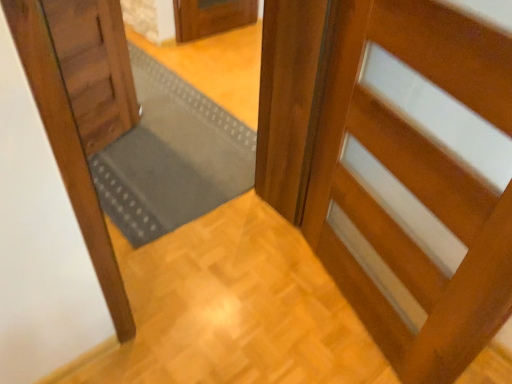
Describe the element at coordinates (233, 309) in the screenshot. This screenshot has height=384, width=512. I see `wooden staircase at lower right` at that location.

This screenshot has height=384, width=512. What do you see at coordinates (170, 157) in the screenshot? I see `gray rubber doormat at center` at bounding box center [170, 157].

The height and width of the screenshot is (384, 512). In order to click on wooden door at left, placed as the 1th door when sorted from left to right in this screenshot , I will do `click(94, 68)`.

Image resolution: width=512 pixels, height=384 pixels. I want to click on glossy wood door at right, the first door positioned from the right, so pos(417,183).

In the image, is wooden door at left, placed as the 1th door when sorted from left to right, on the left side or the right side of gray rubber doormat at center?

Based on their positions, wooden door at left, placed as the 1th door when sorted from left to right, is located to the left of gray rubber doormat at center.

Is wooden door at left, placed as the 1th door when sorted from left to right, inside the boundaries of gray rubber doormat at center, or outside?

wooden door at left, placed as the 1th door when sorted from left to right, lies outside gray rubber doormat at center.

From the image's perspective, relative to wooden staircase at lower right, is gray rubber doormat at center above or below?

Clearly, from the image's perspective, gray rubber doormat at center is above wooden staircase at lower right.

Is gray rubber doormat at center aimed at wooden staircase at lower right?

Yes, gray rubber doormat at center is turned towards wooden staircase at lower right.

At what (x,y) coordinates should I click in order to perform the action: click on path lying below the gray rubber doormat at center (from the image's perspective). Please return your answer as a coordinate pair (x, y). This screenshot has height=384, width=512. Looking at the image, I should click on (233, 309).

Is gray rubber doormat at center inside the boundaries of wooden staircase at lower right, or outside?

gray rubber doormat at center lies outside wooden staircase at lower right.

From a real-world perspective, is glossy wood door at right, positioned as the 2th door in left-to-right order, over gray rubber doormat at center?

Yes, from a real-world perspective, glossy wood door at right, positioned as the 2th door in left-to-right order, is over gray rubber doormat at center

Can gray rubber doormat at center be found inside glossy wood door at right, the first door positioned from the right?

No, gray rubber doormat at center is not inside glossy wood door at right, the first door positioned from the right.

Does glossy wood door at right, the first door positioned from the right, appear on the right side of gray rubber doormat at center?

Correct, you'll find glossy wood door at right, the first door positioned from the right, to the right of gray rubber doormat at center.

What's the angular difference between glossy wood door at right, the first door positioned from the right, and gray rubber doormat at center's facing directions?

118 degrees.

Based on the photo, from the image's perspective, is wooden staircase at lower right above gray rubber doormat at center?

Actually, wooden staircase at lower right appears below gray rubber doormat at center in the image.

Considering the relative sizes of wooden staircase at lower right and gray rubber doormat at center in the image provided, is wooden staircase at lower right smaller than gray rubber doormat at center?

Yes, wooden staircase at lower right is smaller than gray rubber doormat at center.

Which is correct: wooden staircase at lower right is inside gray rubber doormat at center, or outside of it?

wooden staircase at lower right is not inside gray rubber doormat at center, it's outside.

Can you confirm if wooden staircase at lower right is smaller than wooden door at left, positioned as the second door in right-to-left order?

Yes.

Does wooden staircase at lower right have a lesser width compared to wooden door at left, placed as the 1th door when sorted from left to right?

Incorrect, the width of wooden staircase at lower right is not less than that of wooden door at left, placed as the 1th door when sorted from left to right.

Is wooden staircase at lower right closer to the viewer compared to wooden door at left, placed as the 1th door when sorted from left to right?

Yes, the depth of wooden staircase at lower right is less than that of wooden door at left, placed as the 1th door when sorted from left to right.

From a real-world perspective, which is physically below, wooden staircase at lower right or wooden door at left, placed as the 1th door when sorted from left to right?

wooden staircase at lower right.

Is point (167, 269) closer or farther from the camera than point (403, 67)?

Clearly, point (167, 269) is more distant from the camera than point (403, 67).

Are wooden staircase at lower right and glossy wood door at right, positioned as the 2th door in left-to-right order, far apart?

No, wooden staircase at lower right is not far from glossy wood door at right, positioned as the 2th door in left-to-right order.

Can glossy wood door at right, the first door positioned from the right, be found inside wooden staircase at lower right?

No, glossy wood door at right, the first door positioned from the right, is not inside wooden staircase at lower right.

Is wooden staircase at lower right at the right side of glossy wood door at right, positioned as the 2th door in left-to-right order?

No.

Considering the sizes of objects gray rubber doormat at center and glossy wood door at right, positioned as the 2th door in left-to-right order, in the image provided, who is bigger, gray rubber doormat at center or glossy wood door at right, positioned as the 2th door in left-to-right order,?

Bigger between the two is glossy wood door at right, positioned as the 2th door in left-to-right order.

From the image's perspective, which object appears higher, gray rubber doormat at center or glossy wood door at right, the first door positioned from the right?

gray rubber doormat at center.

Identify the location of the 1st door in front of the gray rubber doormat at center, counting from the anchor's position. (94, 68).

Where is `doormat to the left of wooden staircase at lower right`? This screenshot has width=512, height=384. doormat to the left of wooden staircase at lower right is located at coordinates (170, 157).

Considering their positions, is gray rubber doormat at center positioned closer to wooden door at left, placed as the 1th door when sorted from left to right, than wooden staircase at lower right?

gray rubber doormat at center is closer to wooden door at left, placed as the 1th door when sorted from left to right.

Based on their spatial positions, is wooden door at left, positioned as the second door in right-to-left order, or glossy wood door at right, positioned as the 2th door in left-to-right order, further from gray rubber doormat at center?

glossy wood door at right, positioned as the 2th door in left-to-right order.

Consider the image. Based on their spatial positions, is wooden staircase at lower right or wooden door at left, positioned as the second door in right-to-left order, closer to gray rubber doormat at center?

Among the two, wooden door at left, positioned as the second door in right-to-left order, is located nearer to gray rubber doormat at center.

Looking at the image, which one is located closer to gray rubber doormat at center, glossy wood door at right, positioned as the 2th door in left-to-right order, or wooden door at left, placed as the 1th door when sorted from left to right?

The object closer to gray rubber doormat at center is wooden door at left, placed as the 1th door when sorted from left to right.

Which object lies nearer to the anchor point wooden door at left, positioned as the second door in right-to-left order, gray rubber doormat at center or glossy wood door at right, the first door positioned from the right?

Based on the image, gray rubber doormat at center appears to be nearer to wooden door at left, positioned as the second door in right-to-left order.

From the image, which object appears to be nearer to glossy wood door at right, the first door positioned from the right, wooden staircase at lower right or gray rubber doormat at center?

The object closer to glossy wood door at right, the first door positioned from the right, is wooden staircase at lower right.

Considering their positions, is glossy wood door at right, the first door positioned from the right, positioned further to gray rubber doormat at center than wooden staircase at lower right?

Among the two, glossy wood door at right, the first door positioned from the right, is located further to gray rubber doormat at center.

When comparing their distances from gray rubber doormat at center, does wooden door at left, placed as the 1th door when sorted from left to right, or wooden staircase at lower right seem further?

Among the two, wooden staircase at lower right is located further to gray rubber doormat at center.

Identify the location of path between glossy wood door at right, the first door positioned from the right, and gray rubber doormat at center from front to back. (233, 309).

Image resolution: width=512 pixels, height=384 pixels. Find the location of `door positioned between glossy wood door at right, the first door positioned from the right, and gray rubber doormat at center from near to far`. door positioned between glossy wood door at right, the first door positioned from the right, and gray rubber doormat at center from near to far is located at coordinates (94, 68).

I want to click on door between wooden door at left, placed as the 1th door when sorted from left to right, and wooden staircase at lower right from top to bottom, so click(417, 183).

Locate an element on the screen. doormat that lies between wooden door at left, placed as the 1th door when sorted from left to right, and wooden staircase at lower right from top to bottom is located at coordinates (170, 157).